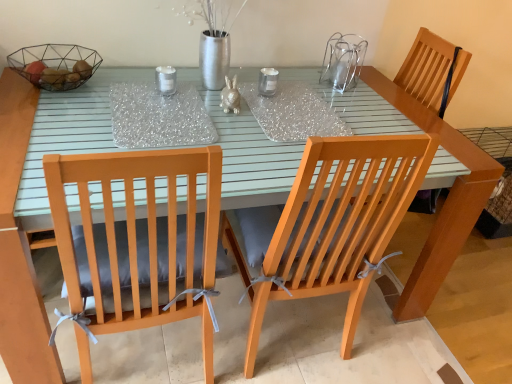
Question: Is matte gray cushion at left, marked as the first chair in a left-to-right arrangement, thinner than wooden chair at right?

Choices:
 (A) no
 (B) yes

Answer: (B)

Question: Considering the relative sizes of matte gray cushion at left, marked as the first chair in a left-to-right arrangement, and wooden chair at right in the image provided, is matte gray cushion at left, marked as the first chair in a left-to-right arrangement, bigger than wooden chair at right?

Choices:
 (A) yes
 (B) no

Answer: (B)

Question: Does matte gray cushion at left, which appears as the 2th chair when viewed from the right, touch wooden chair at right?

Choices:
 (A) no
 (B) yes

Answer: (A)

Question: Can you confirm if matte gray cushion at left, which appears as the 2th chair when viewed from the right, is taller than wooden chair at right?

Choices:
 (A) yes
 (B) no

Answer: (B)

Question: Can you confirm if matte gray cushion at left, marked as the first chair in a left-to-right arrangement, is smaller than wooden chair at right?

Choices:
 (A) yes
 (B) no

Answer: (A)

Question: Which is correct: wooden chair at right is inside matte gray cushion at left, marked as the first chair in a left-to-right arrangement, or outside of it?

Choices:
 (A) inside
 (B) outside

Answer: (B)

Question: Is wooden chair at right to the left or to the right of matte gray cushion at left, marked as the first chair in a left-to-right arrangement, in the image?

Choices:
 (A) right
 (B) left

Answer: (A)

Question: From a real-world perspective, is wooden chair at right physically located above or below matte gray cushion at left, marked as the first chair in a left-to-right arrangement?

Choices:
 (A) below
 (B) above

Answer: (B)

Question: In terms of size, does wooden chair at right appear bigger or smaller than matte gray cushion at left, marked as the first chair in a left-to-right arrangement?

Choices:
 (A) small
 (B) big

Answer: (B)

Question: From a real-world perspective, is metallic wire basket at upper left physically located above or below matte gray cushion at left, marked as the first chair in a left-to-right arrangement?

Choices:
 (A) above
 (B) below

Answer: (A)

Question: Would you say metallic wire basket at upper left is to the left or to the right of matte gray cushion at left, which appears as the 2th chair when viewed from the right, in the picture?

Choices:
 (A) right
 (B) left

Answer: (B)

Question: Is metallic wire basket at upper left taller or shorter than matte gray cushion at left, which appears as the 2th chair when viewed from the right?

Choices:
 (A) tall
 (B) short

Answer: (B)

Question: In terms of size, does metallic wire basket at upper left appear bigger or smaller than matte gray cushion at left, marked as the first chair in a left-to-right arrangement?

Choices:
 (A) small
 (B) big

Answer: (A)

Question: From the image's perspective, is wooden chair at right located above or below metallic wire basket at upper left?

Choices:
 (A) above
 (B) below

Answer: (B)

Question: Relative to metallic wire basket at upper left, is wooden chair at right in front or behind?

Choices:
 (A) behind
 (B) front

Answer: (A)